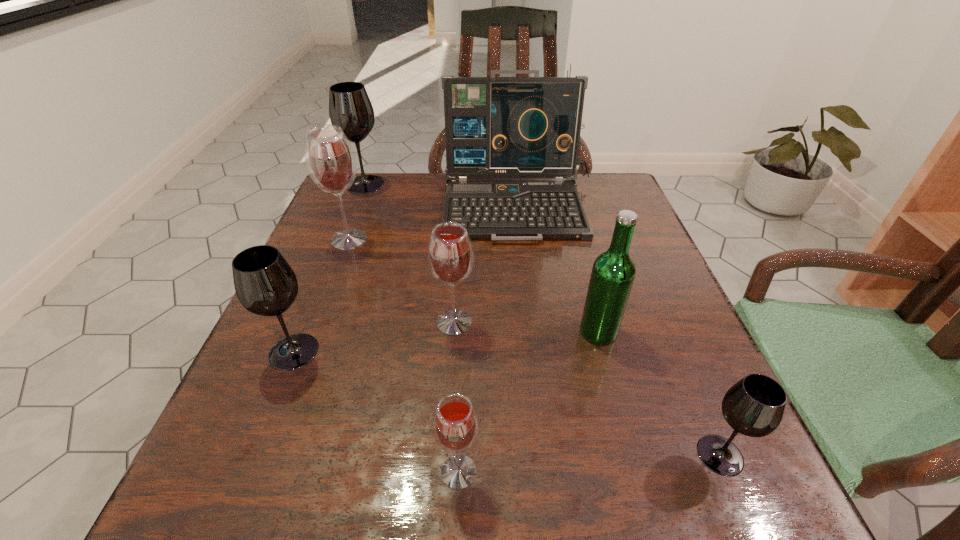
I want to click on the nearest red wineglass, so click(455, 424).

At what (x,y) coordinates should I click in order to perform the action: click on free location located on the front-facing side of the laptop computer. Please return your answer as a coordinate pair (x, y). Looking at the image, I should click on (528, 280).

The height and width of the screenshot is (540, 960). In order to click on vacant region located on the right of the biggest gray wineglass in this screenshot , I will do `click(503, 184)`.

Image resolution: width=960 pixels, height=540 pixels. Identify the location of vacant area situated 0.160m on the front of the leftmost red wineglass. (325, 304).

Locate an element on the screen. free space located 0.050m on the front of the green beer bottle is located at coordinates (609, 370).

Locate an element on the screen. The height and width of the screenshot is (540, 960). vacant space situated on the right of the second farthest red wineglass is located at coordinates (514, 322).

Locate an element on the screen. The height and width of the screenshot is (540, 960). vacant area located on the back of the second smallest gray wineglass is located at coordinates (332, 256).

In order to click on free spot located 0.290m on the left of the rightmost object in this screenshot , I will do `click(491, 455)`.

Locate an element on the screen. vacant region located 0.360m on the back of the nearest red wineglass is located at coordinates (466, 282).

Where is `laptop computer that is positioned at the far edge`? Image resolution: width=960 pixels, height=540 pixels. laptop computer that is positioned at the far edge is located at coordinates (495, 127).